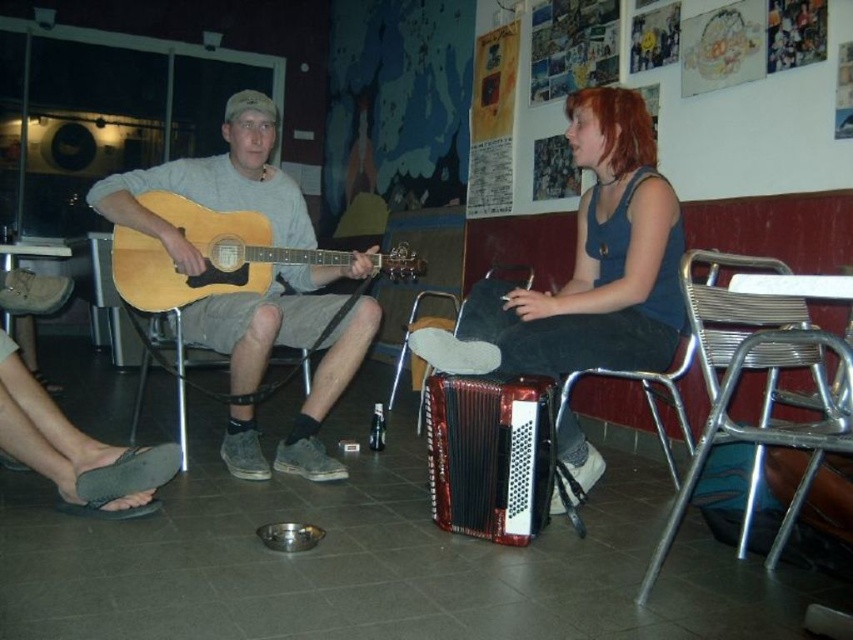
Question: Does metallic silver chair at right come in front of metallic brown accordion at center?

Choices:
 (A) yes
 (B) no

Answer: (A)

Question: Observing the image, what is the correct spatial positioning of matte wood guitar at left in reference to metallic silver chair at left?

Choices:
 (A) below
 (B) above

Answer: (B)

Question: Which of the following is the farthest from the observer?

Choices:
 (A) (231, 284)
 (B) (308, 234)

Answer: (B)

Question: Can you confirm if light brown wood guitar at left is positioned to the right of metallic silver chair at left?

Choices:
 (A) no
 (B) yes

Answer: (B)

Question: Which is farther from the light brown wood guitar at left?

Choices:
 (A) metallic silver chair at center
 (B) matte wood guitar at left

Answer: (A)

Question: Among these points, which one is farthest from the camera?

Choices:
 (A) (786, 269)
 (B) (525, 497)
 (C) (236, 259)

Answer: (C)